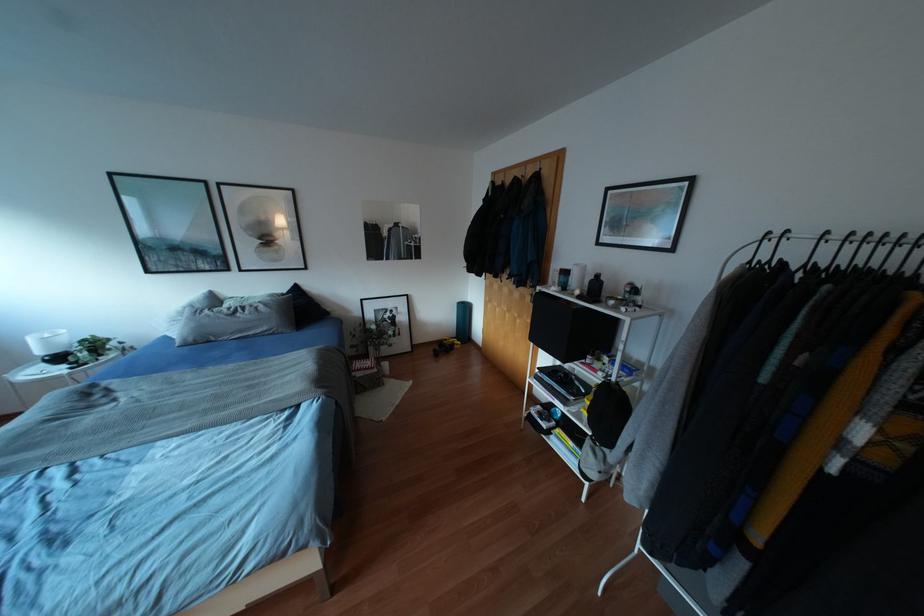
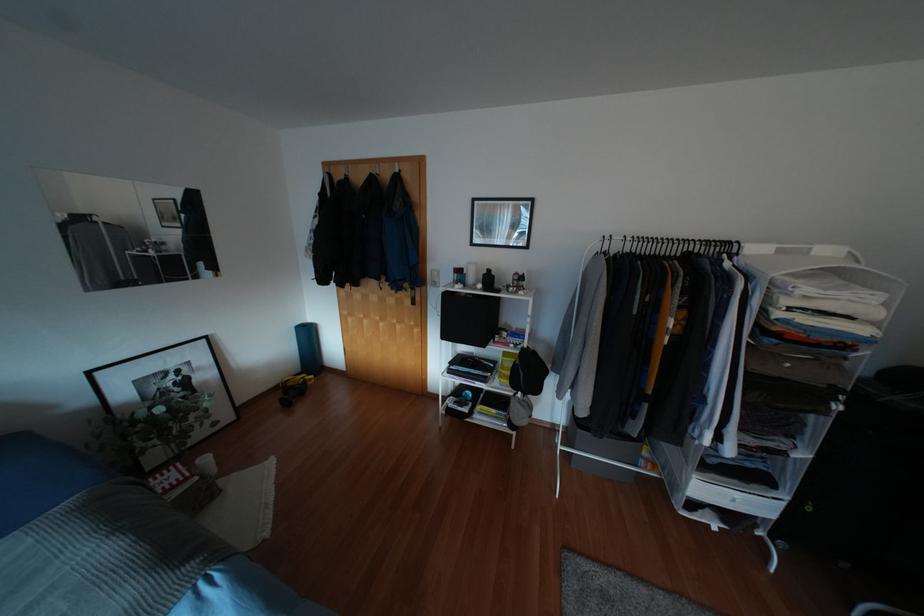
Question: The first image is from the beginning of the video and the second image is from the end. How did the camera likely rotate when shooting the video?

Choices:
 (A) Left
 (B) Right
 (C) Up
 (D) Down

Answer: (B)